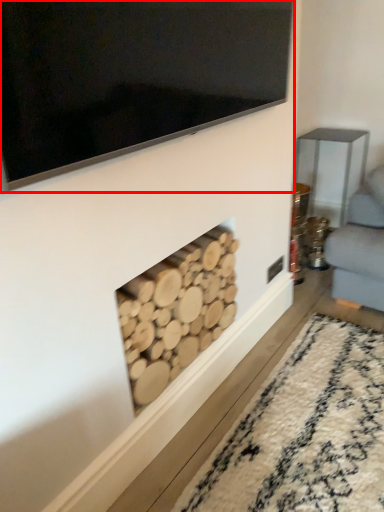
Question: Considering the relative positions of television (annotated by the red box) and fireplace in the image provided, where is television (annotated by the red box) located with respect to the staircase?

Choices:
 (A) left
 (B) right

Answer: (B)